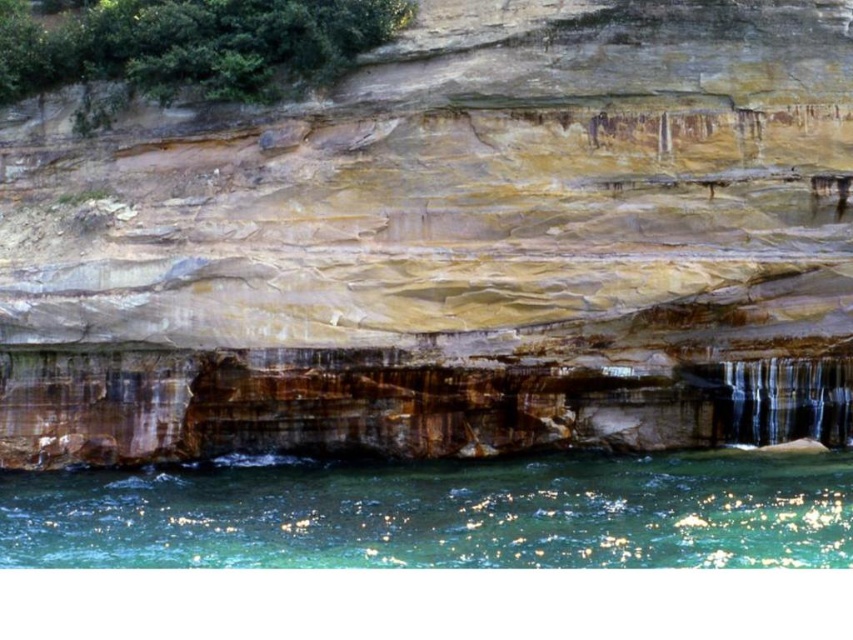
Which is below, rustic stone cliff at center or clear glass water at lower center?

clear glass water at lower center is lower down.

Does point (416, 20) come closer to viewer compared to point (323, 524)?

No, it is behind (323, 524).

You are a GUI agent. You are given a task and a screenshot of the screen. Output one action in this format:
    pyautogui.click(x=<x>, y=<y>)
    Task: Click on the rustic stone cliff at center
    
    Given the screenshot: What is the action you would take?
    pyautogui.click(x=438, y=243)

Does clear glass water at lower center have a lesser width compared to clear glass waterfall at lower right?

No, clear glass water at lower center is not thinner than clear glass waterfall at lower right.

Image resolution: width=853 pixels, height=640 pixels. Identify the location of clear glass water at lower center. (439, 513).

Between point (401, 470) and point (793, 365), which one is positioned behind?

The point (793, 365) is behind.

Where is `clear glass water at lower center`? clear glass water at lower center is located at coordinates (439, 513).

Can you confirm if rustic stone cliff at center is positioned above clear glass waterfall at lower right?

Indeed, rustic stone cliff at center is positioned over clear glass waterfall at lower right.

What do you see at coordinates (438, 243) in the screenshot? I see `rustic stone cliff at center` at bounding box center [438, 243].

Is point (126, 160) more distant than point (834, 388)?

Yes, point (126, 160) is behind point (834, 388).

Locate an element on the screen. The image size is (853, 640). rustic stone cliff at center is located at coordinates (438, 243).